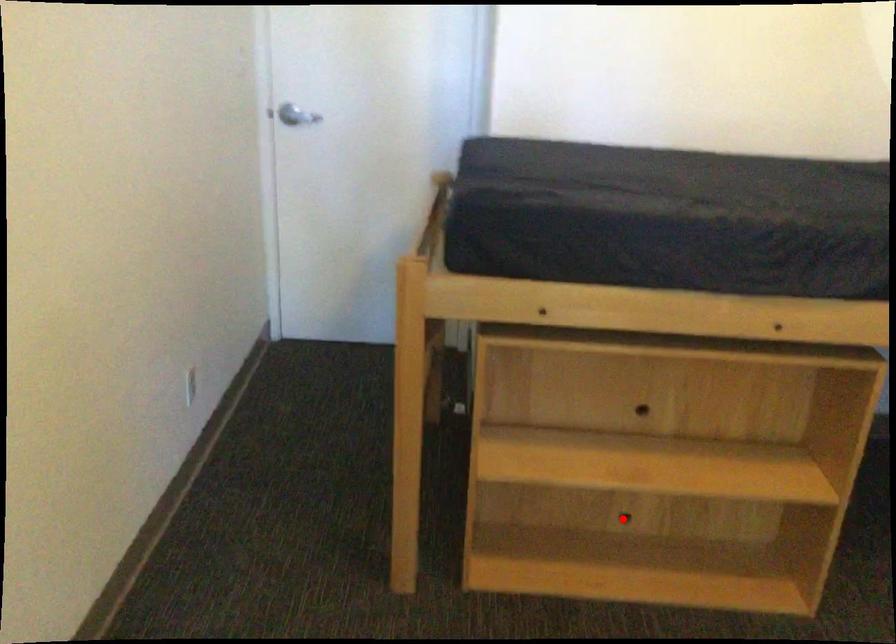
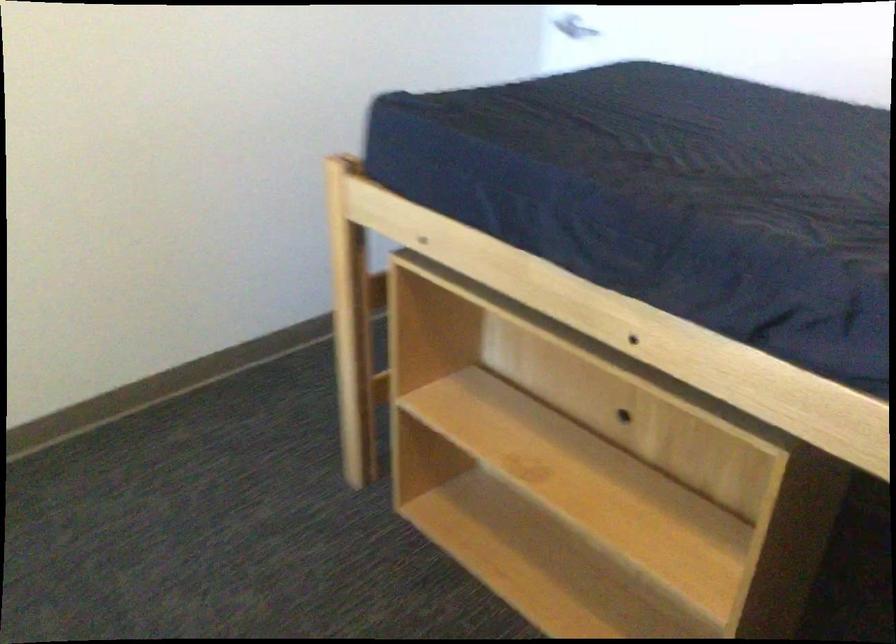
Question: I am providing you with two images of the same scene from different viewpoints. A red point is marked on the first image. At the location where the point appears in image 1, is it still visible in image 2?

Choices:
 (A) Yes
 (B) No

Answer: (B)